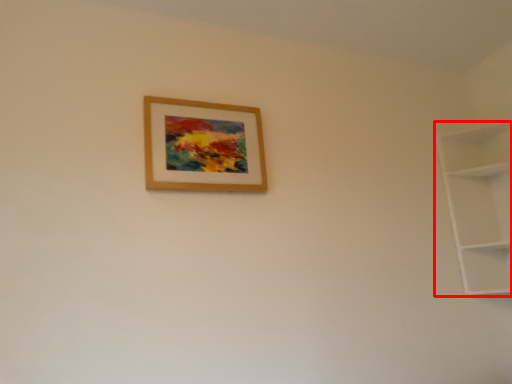
Question: From the image's perspective, what is the correct spatial positioning of shelf (annotated by the red box) in reference to picture frame?

Choices:
 (A) above
 (B) below

Answer: (B)